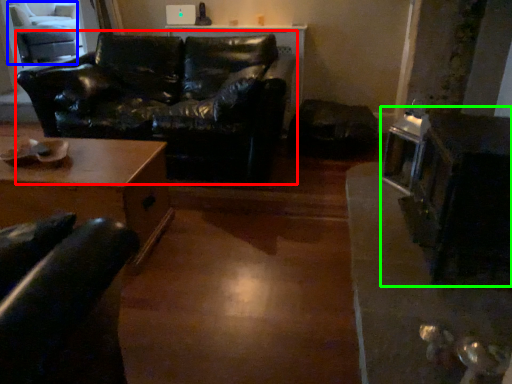
Question: Which object is the closest to the studio couch (highlighted by a red box)? Choose among these: swivel chair (highlighted by a blue box) or appliance (highlighted by a green box).

Choices:
 (A) swivel chair
 (B) appliance

Answer: (B)